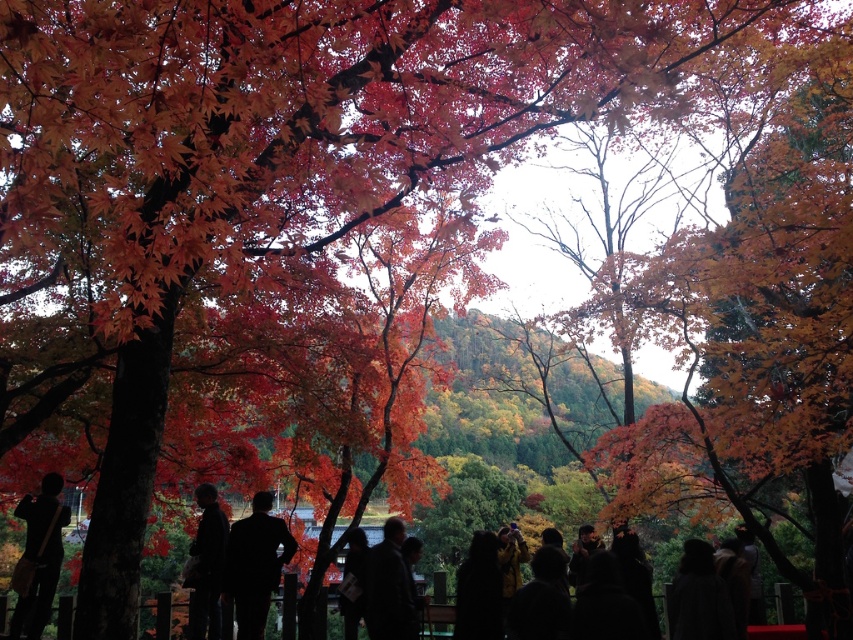
You are an artist who wants to paint the autumn scene. You have a black fabric at center. Where should you place it in your canvas to match the original image?

The black fabric at center should be placed at point (254, 564) on the canvas to match the original image.

You are standing in an autumn forest and see the black fabric at center and the dark fabric jacket at center. Which one is nearer to you?

The black fabric at center is closer to the viewer than the dark fabric jacket at center.